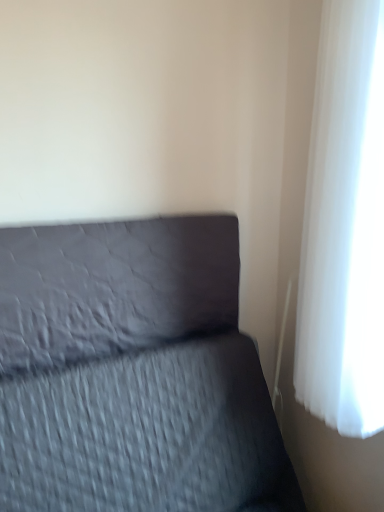
Question: Considering the relative sizes of white sheer curtain at right and matte gray pillow at center in the image provided, is white sheer curtain at right taller than matte gray pillow at center?

Choices:
 (A) no
 (B) yes

Answer: (B)

Question: Can you confirm if white sheer curtain at right is positioned to the right of matte gray pillow at center?

Choices:
 (A) no
 (B) yes

Answer: (B)

Question: Does white sheer curtain at right have a lesser height compared to matte gray pillow at center?

Choices:
 (A) yes
 (B) no

Answer: (B)

Question: Does white sheer curtain at right have a larger size compared to matte gray pillow at center?

Choices:
 (A) no
 (B) yes

Answer: (B)

Question: Does white sheer curtain at right appear on the left side of matte gray pillow at center?

Choices:
 (A) yes
 (B) no

Answer: (B)

Question: Is white sheer curtain at right positioned in front of matte gray pillow at center?

Choices:
 (A) yes
 (B) no

Answer: (A)

Question: From the image's perspective, would you say textured gray bed at lower left is shown under white sheer curtain at right?

Choices:
 (A) no
 (B) yes

Answer: (B)

Question: Is textured gray bed at lower left positioned with its back to white sheer curtain at right?

Choices:
 (A) yes
 (B) no

Answer: (B)

Question: Is white sheer curtain at right located within textured gray bed at lower left?

Choices:
 (A) yes
 (B) no

Answer: (B)

Question: Can you confirm if textured gray bed at lower left is wider than white sheer curtain at right?

Choices:
 (A) no
 (B) yes

Answer: (B)

Question: From a real-world perspective, is textured gray bed at lower left on top of white sheer curtain at right?

Choices:
 (A) yes
 (B) no

Answer: (B)

Question: Considering the relative positions of textured gray bed at lower left and white sheer curtain at right in the image provided, is textured gray bed at lower left to the left of white sheer curtain at right from the viewer's perspective?

Choices:
 (A) no
 (B) yes

Answer: (B)

Question: Would you consider matte gray pillow at center to be distant from white sheer curtain at right?

Choices:
 (A) no
 (B) yes

Answer: (A)